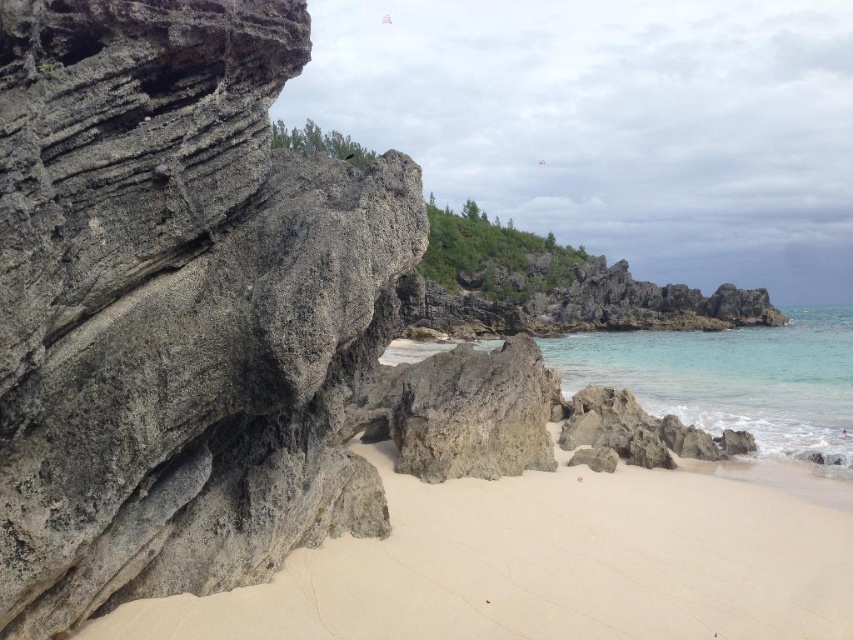
Question: Does clear water at beach center have a lesser width compared to gray rough rock at center?

Choices:
 (A) yes
 (B) no

Answer: (B)

Question: Which object is positioned farthest from the sandy beach at lower left?

Choices:
 (A) gray rough rock at center
 (B) gray rough rock at left

Answer: (A)

Question: Is gray rough rock at left bigger than clear water at beach center?

Choices:
 (A) yes
 (B) no

Answer: (B)

Question: Among these objects, which one is nearest to the camera?

Choices:
 (A) gray rough rock at center
 (B) gray rough rock at left

Answer: (B)

Question: Which object is farther from the camera taking this photo?

Choices:
 (A) clear water at beach center
 (B) gray rough rock at center
 (C) gray rough rock at left
 (D) sandy beach at lower left

Answer: (B)

Question: Where is sandy beach at lower left located in relation to clear water at beach center in the image?

Choices:
 (A) left
 (B) right

Answer: (A)